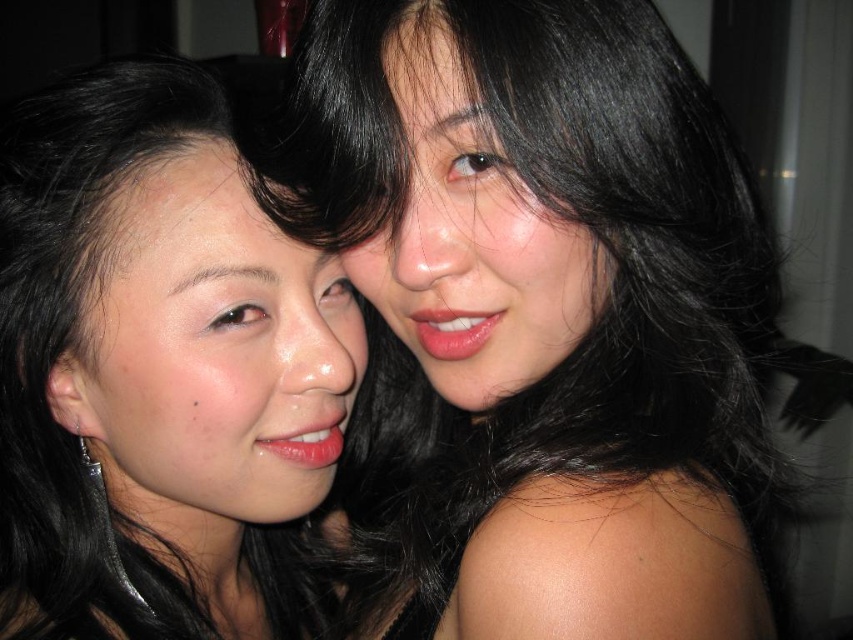
Based on the photo, you are a photographer at a social event. You want to frame a photo that includes both the matte black hair at left and the matte pink lipstick at center. Since you need to ensure both fit in the frame, which object requires more space horizontally?

The matte black hair at left requires more space horizontally because its width surpasses that of the matte pink lipstick at center.

You are a photographer trying to capture a closeup of both the matte black hair at left and the matte pink lipstick at center. Since you want both to be clearly visible in the frame, which object should you focus on to ensure the larger one is sharp?

The matte black hair at left is bigger than the matte pink lipstick at center, so you should focus on the matte black hair at left to ensure the larger object is sharp.

You are a photographer trying to capture a closeup of the matte pink lipstick at center without the smooth skin face at upper right blocking it. Can you adjust your camera angle to achieve this?

The smooth skin face at upper right is in front of the matte pink lipstick at center, so you need to move your camera angle to the side or behind the face to avoid obstruction.